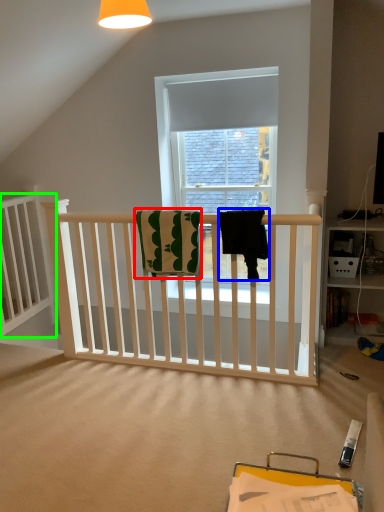
Question: Estimate the real-world distances between objects in this image. Which object is closer to beach towel (highlighted by a red box), beach towel (highlighted by a blue box) or bed frame (highlighted by a green box)?

Choices:
 (A) beach towel
 (B) bed frame

Answer: (A)